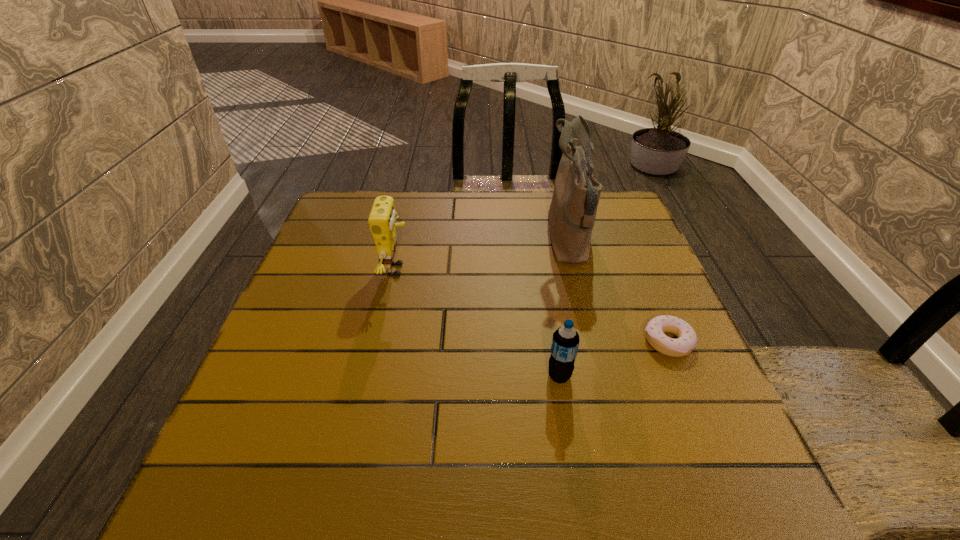
The height and width of the screenshot is (540, 960). Identify the location of vacant area that lies between the third shortest object and the tallest object. (483, 255).

The height and width of the screenshot is (540, 960). I want to click on free spot between the nearest object and the doughnut, so click(613, 359).

Locate an element on the screen. object that is the second closest one to the tallest object is located at coordinates (565, 342).

Find the location of a particular element. This screenshot has width=960, height=540. object that is the second closest to the third tallest object is located at coordinates (x=572, y=212).

Locate an element on the screen. The image size is (960, 540). free point that satisfies the following two spatial constraints: 1. on the front-facing side of the tallest object; 2. on the left side of the shortest object is located at coordinates (594, 342).

The height and width of the screenshot is (540, 960). In order to click on blank space that satisfies the following two spatial constraints: 1. on the face of the sponge; 2. on the back side of the rightmost object in this screenshot , I will do `click(381, 342)`.

Identify the location of free point that satisfies the following two spatial constraints: 1. on the face of the sponge; 2. on the left side of the third tallest object. (373, 376).

This screenshot has width=960, height=540. I want to click on free spot that satisfies the following two spatial constraints: 1. on the face of the third shortest object; 2. on the right side of the shortest object, so click(381, 342).

Where is `vacant area that satisfies the following two spatial constraints: 1. on the back side of the nearest object; 2. on the face of the third shortest object`? The image size is (960, 540). vacant area that satisfies the following two spatial constraints: 1. on the back side of the nearest object; 2. on the face of the third shortest object is located at coordinates (541, 270).

This screenshot has width=960, height=540. I want to click on free space that satisfies the following two spatial constraints: 1. on the back side of the soda bottle; 2. on the right side of the shortest object, so point(554,342).